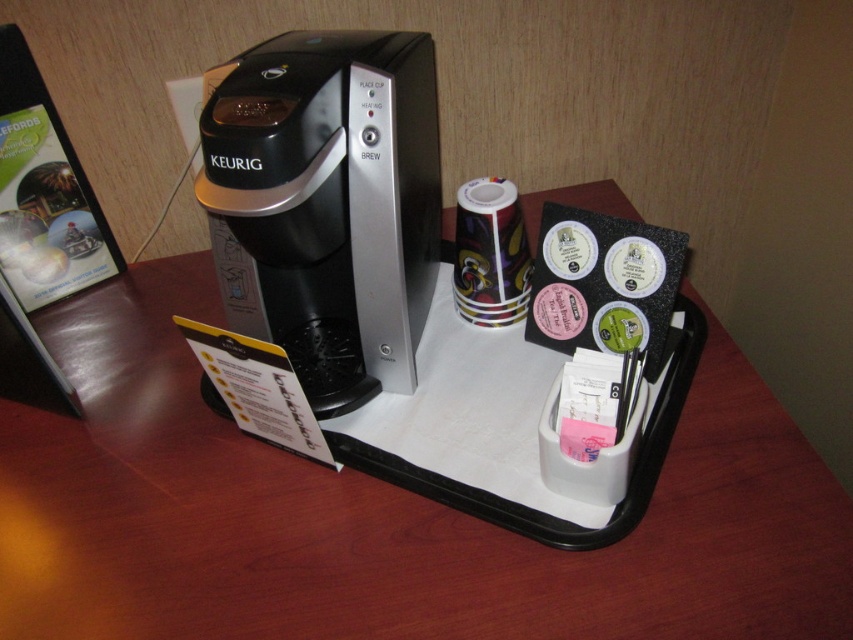
Question: Which point is closer to the camera taking this photo?

Choices:
 (A) (714, 442)
 (B) (251, 259)

Answer: (A)

Question: Which point is farther to the camera?

Choices:
 (A) black plastic keurig at center
 (B) black plastic tray at center

Answer: (A)

Question: Does black plastic tray at center lie in front of black plastic keurig at center?

Choices:
 (A) yes
 (B) no

Answer: (A)

Question: Does black plastic tray at center appear under black plastic keurig at center?

Choices:
 (A) yes
 (B) no

Answer: (A)

Question: In this image, where is black plastic tray at center located relative to black plastic keurig at center?

Choices:
 (A) left
 (B) right

Answer: (B)

Question: Which point is farther to the camera?

Choices:
 (A) (387, 285)
 (B) (19, 461)

Answer: (B)